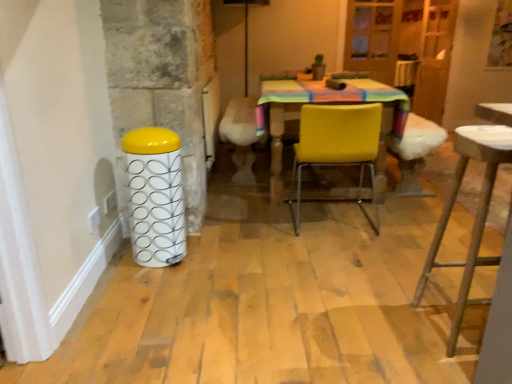
Where is `free space in front of white glossy bar stool at left`? The height and width of the screenshot is (384, 512). free space in front of white glossy bar stool at left is located at coordinates (151, 282).